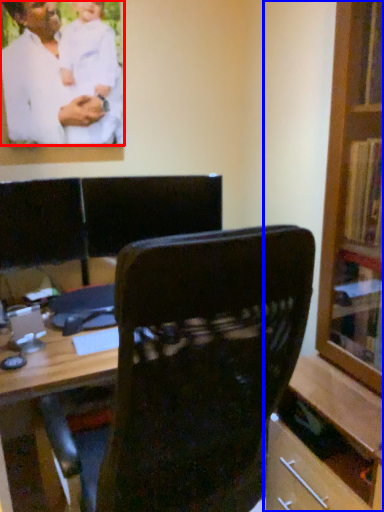
Question: Which object appears farthest to the camera in this image, man (highlighted by a red box) or bookcase (highlighted by a blue box)?

Choices:
 (A) man
 (B) bookcase

Answer: (A)